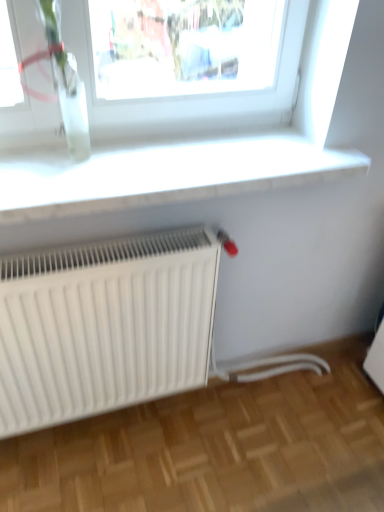
Locate an element on the screen. The width and height of the screenshot is (384, 512). free space below white matte radiator at lower left (from a real-world perspective) is located at coordinates (119, 425).